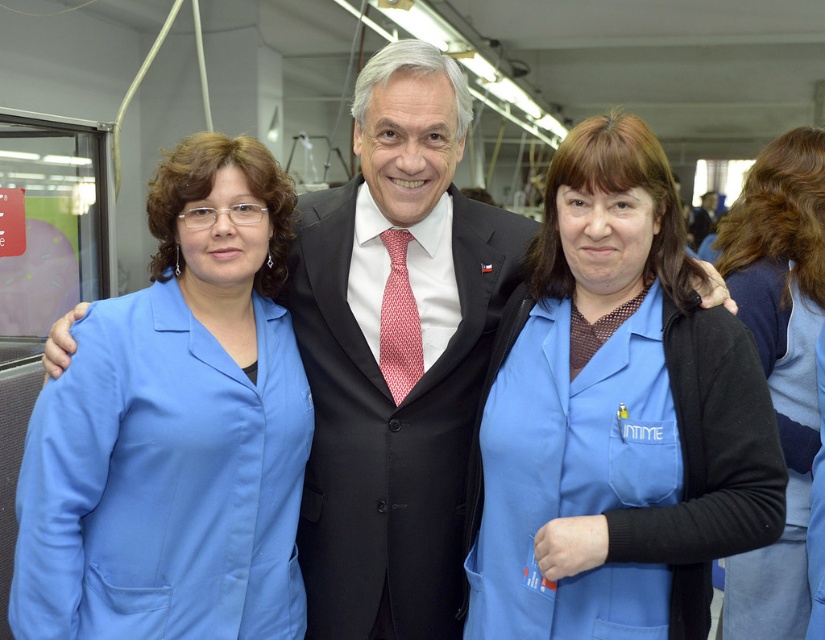
Question: Is matte blue lab coat at left closer to the viewer compared to blue fabric shirt at right?

Choices:
 (A) no
 (B) yes

Answer: (B)

Question: Is matte blue lab coat at left above black satin suit at center?

Choices:
 (A) no
 (B) yes

Answer: (B)

Question: Which point appears farthest from the camera in this image?

Choices:
 (A) (196, 198)
 (B) (442, 621)
 (C) (742, 436)

Answer: (B)

Question: Among these points, which one is farthest from the camera?

Choices:
 (A) (816, 308)
 (B) (53, 412)
 (C) (343, 531)
 (D) (748, 349)

Answer: (A)

Question: Is matte blue lab coat at left thinner than blue fabric shirt at right?

Choices:
 (A) no
 (B) yes

Answer: (A)

Question: Estimate the real-world distances between objects in this image. Which object is closer to the blue fabric shirt at right?

Choices:
 (A) matte blue lab coat at left
 (B) black satin suit at center
 (C) blue fabric uniform at center

Answer: (C)